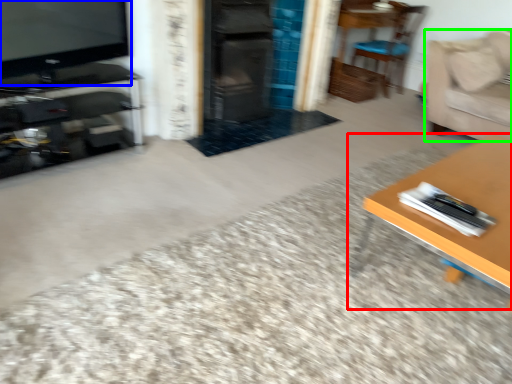
Question: Which object is positioned closest to table (highlighted by a red box)? Select from television (highlighted by a blue box) and couch (highlighted by a green box).

Choices:
 (A) television
 (B) couch

Answer: (B)